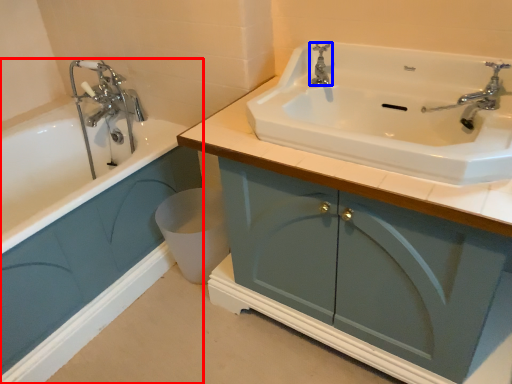
Question: Which point is closer to the camera, bathroom cabinet (highlighted by a red box) or tap (highlighted by a blue box)?

Choices:
 (A) bathroom cabinet
 (B) tap

Answer: (A)